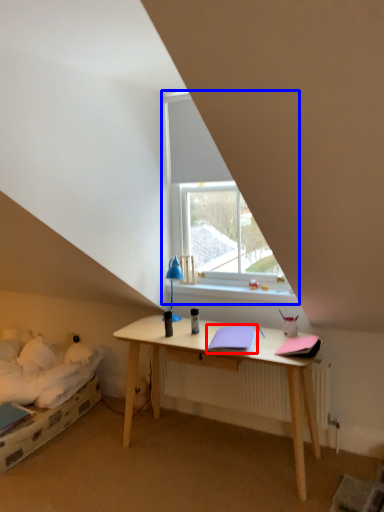
Question: Among these objects, which one is nearest to the camera, notebook (highlighted by a red box) or window (highlighted by a blue box)?

Choices:
 (A) notebook
 (B) window

Answer: (A)